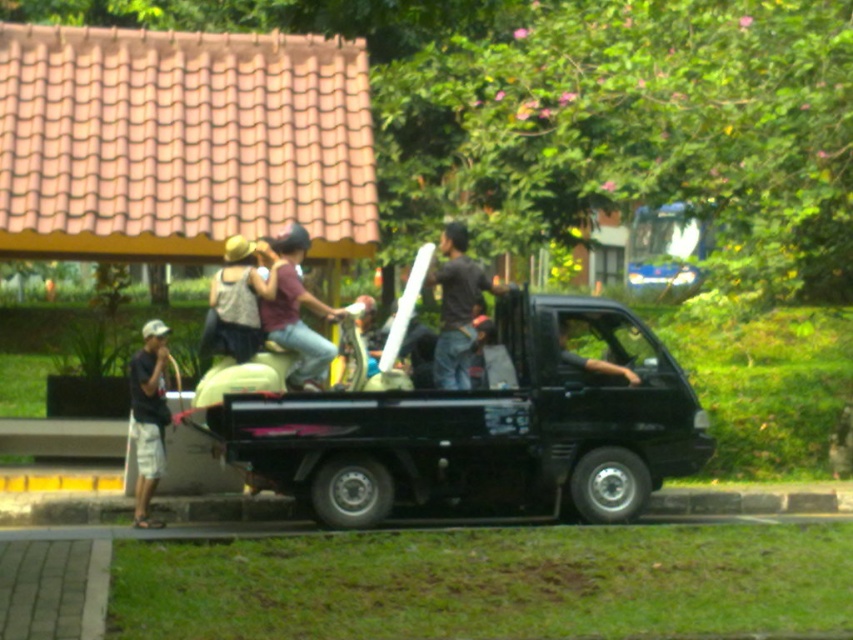
Can you confirm if black glossy pickup truck at center is shorter than dark gray shirt at center?

No.

Can you confirm if black glossy pickup truck at center is positioned below dark gray shirt at center?

Correct, black glossy pickup truck at center is located below dark gray shirt at center.

What do you see at coordinates (486, 428) in the screenshot?
I see `black glossy pickup truck at center` at bounding box center [486, 428].

You are a GUI agent. You are given a task and a screenshot of the screen. Output one action in this format:
    pyautogui.click(x=<x>, y=<y>)
    Task: Click on the black glossy pickup truck at center
    
    Given the screenshot: What is the action you would take?
    pyautogui.click(x=486, y=428)

Can you confirm if dark gray shirt at center is positioned above white cotton cap at left?

Yes.

This screenshot has height=640, width=853. Describe the element at coordinates (456, 307) in the screenshot. I see `dark gray shirt at center` at that location.

Does point (479, 285) come behind point (131, 376)?

That is True.

I want to click on dark gray shirt at center, so click(456, 307).

Between black glossy pickup truck at center and white cotton cap at left, which one is positioned lower?

Positioned lower is white cotton cap at left.

Identify the location of black glossy pickup truck at center. This screenshot has height=640, width=853. (486, 428).